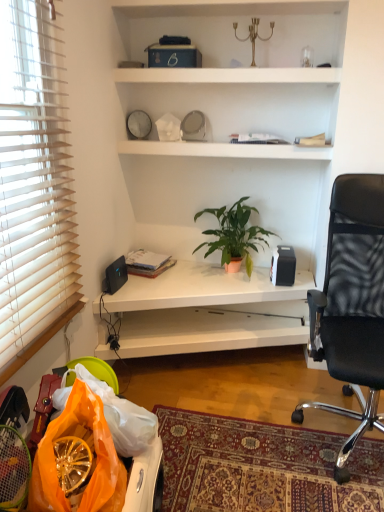
Locate an element on the screen. vacant space in black mesh office chair at right (from a real-world perspective) is located at coordinates (343, 414).